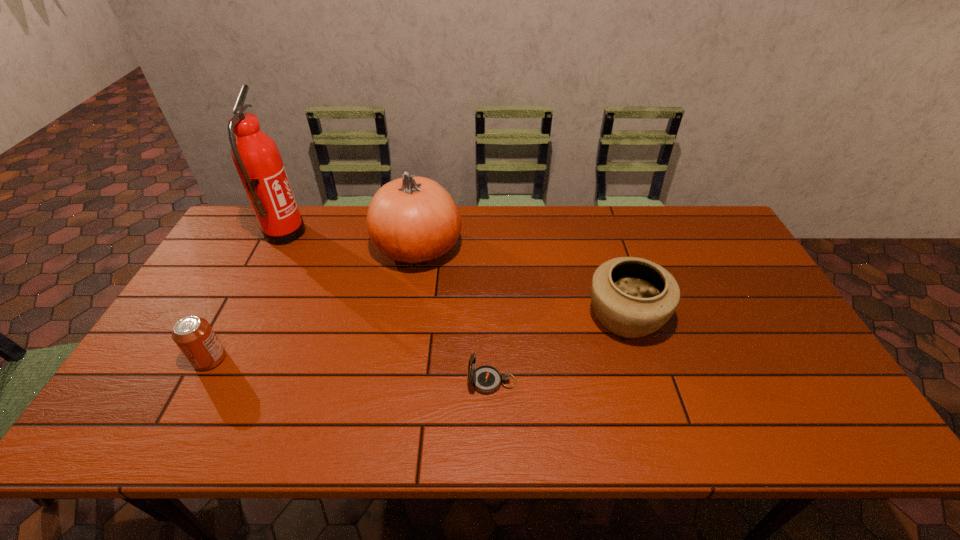
Locate an element on the screen. The height and width of the screenshot is (540, 960). vacant region located 0.090m on the left of the rightmost object is located at coordinates (552, 318).

Image resolution: width=960 pixels, height=540 pixels. Identify the location of vacant space situated on the front of the can. (175, 425).

Locate an element on the screen. The image size is (960, 540). free space located 0.050m on the face of the shortest object is located at coordinates (446, 382).

Identify the location of free spot located on the face of the shortest object. (319, 382).

Identify the location of free region located 0.140m on the face of the shortest object. Image resolution: width=960 pixels, height=540 pixels. (409, 382).

The image size is (960, 540). Identify the location of fire extinguisher at the far edge. (257, 159).

Locate an element on the screen. The height and width of the screenshot is (540, 960). pumpkin that is at the far edge is located at coordinates (413, 220).

Locate an element on the screen. The image size is (960, 540). fire extinguisher located in the left edge section of the desktop is located at coordinates (257, 159).

Find the location of a particular element. Image resolution: width=960 pixels, height=540 pixels. can positioned at the left edge is located at coordinates (194, 336).

Where is `object that is at the far left corner`? The width and height of the screenshot is (960, 540). object that is at the far left corner is located at coordinates (257, 159).